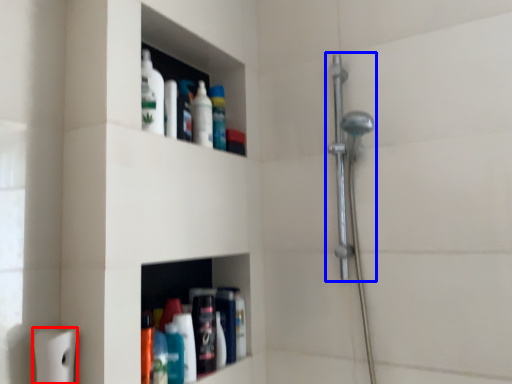
Question: Which of the following is the closest to the observer, toilet paper (highlighted by a red box) or shower (highlighted by a blue box)?

Choices:
 (A) toilet paper
 (B) shower

Answer: (A)